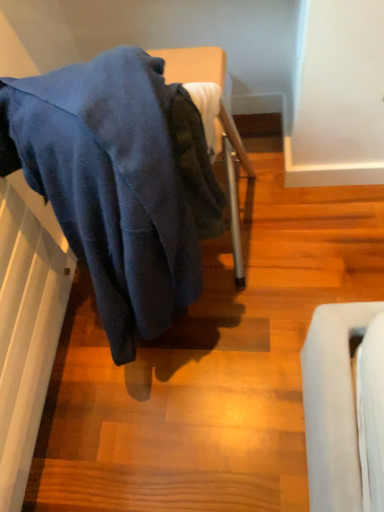
Question: Should I look upward or downward to see dark blue fabric at center?

Choices:
 (A) up
 (B) down

Answer: (A)